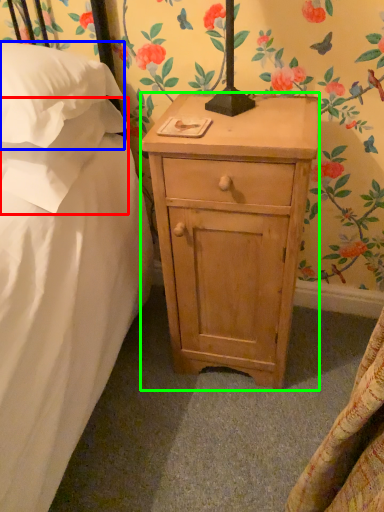
Question: Which is farther away from pillow (highlighted by a red box)? pillow (highlighted by a blue box) or nightstand (highlighted by a green box)?

Choices:
 (A) pillow
 (B) nightstand

Answer: (B)